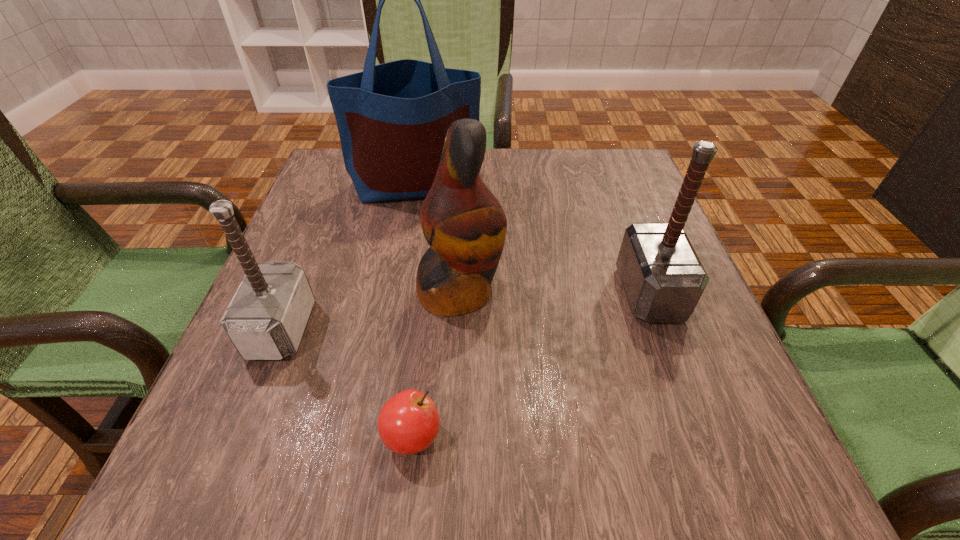
You are a GUI agent. You are given a task and a screenshot of the screen. Output one action in this format:
    pyautogui.click(x=<x>, y=<y>)
    Task: Click on the free space at the left edge of the desktop
    The height and width of the screenshot is (540, 960).
    Given the screenshot: What is the action you would take?
    pyautogui.click(x=282, y=364)

Identify the location of vacant space at the far left corner of the desktop. The image size is (960, 540). (333, 161).

In order to click on free spot at the near left corner of the desktop in this screenshot , I will do `click(221, 499)`.

Where is `vacant space at the near right corner of the desktop`? Image resolution: width=960 pixels, height=540 pixels. vacant space at the near right corner of the desktop is located at coordinates (699, 436).

Identify the location of vacant area that lies between the tallest object and the nearest object. (415, 310).

Where is `vacant space in between the rightmost object and the parrot`? vacant space in between the rightmost object and the parrot is located at coordinates (555, 292).

Where is `vacant area that lies between the apple and the right hammer`? vacant area that lies between the apple and the right hammer is located at coordinates (531, 364).

You are a GUI agent. You are given a task and a screenshot of the screen. Output one action in this format:
    pyautogui.click(x=<x>, y=<y>)
    Task: Click on the free space between the tallest object and the shortest object
    The image size is (960, 540).
    Given the screenshot: What is the action you would take?
    pyautogui.click(x=415, y=310)

You are a GUI agent. You are given a task and a screenshot of the screen. Output one action in this format:
    pyautogui.click(x=<x>, y=<y>)
    Task: Click on the blank region between the nearest object and the tallest object
    The image size is (960, 540).
    Given the screenshot: What is the action you would take?
    pyautogui.click(x=415, y=310)

I want to click on vacant area that lies between the farthest object and the rightmost object, so click(x=534, y=239).